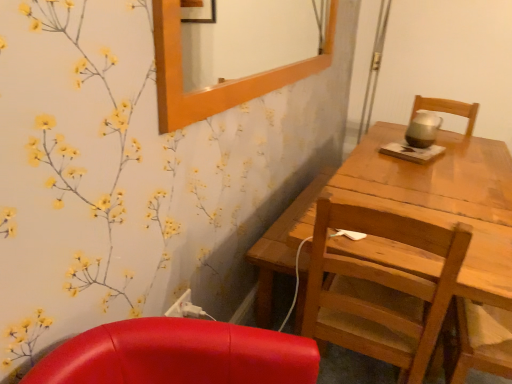
Question: Can you confirm if wooden frame at upper center is smaller than white plastic power outlet at lower center?

Choices:
 (A) no
 (B) yes

Answer: (A)

Question: Does wooden frame at upper center have a greater height compared to white plastic power outlet at lower center?

Choices:
 (A) yes
 (B) no

Answer: (A)

Question: Does wooden frame at upper center have a lesser width compared to white plastic power outlet at lower center?

Choices:
 (A) no
 (B) yes

Answer: (A)

Question: Is wooden frame at upper center not within white plastic power outlet at lower center?

Choices:
 (A) yes
 (B) no

Answer: (A)

Question: Is wooden frame at upper center in contact with white plastic power outlet at lower center?

Choices:
 (A) no
 (B) yes

Answer: (A)

Question: Considering the positions of wooden chair at right and gold metallic teapot at upper right in the image, is wooden chair at right bigger or smaller than gold metallic teapot at upper right?

Choices:
 (A) big
 (B) small

Answer: (A)

Question: In terms of width, does wooden chair at right look wider or thinner when compared to gold metallic teapot at upper right?

Choices:
 (A) thin
 (B) wide

Answer: (B)

Question: In the image, is wooden chair at right positioned in front of or behind gold metallic teapot at upper right?

Choices:
 (A) behind
 (B) front

Answer: (B)

Question: From a real-world perspective, relative to gold metallic teapot at upper right, is wooden chair at right vertically above or below?

Choices:
 (A) above
 (B) below

Answer: (B)

Question: Is wooden frame at upper center bigger or smaller than gold metallic teapot at upper right?

Choices:
 (A) big
 (B) small

Answer: (A)

Question: Is point (188, 34) closer or farther from the camera than point (415, 142)?

Choices:
 (A) closer
 (B) farther

Answer: (B)

Question: From the image's perspective, relative to gold metallic teapot at upper right, is wooden frame at upper center above or below?

Choices:
 (A) above
 (B) below

Answer: (A)

Question: Choose the correct answer: Is wooden frame at upper center inside gold metallic teapot at upper right or outside it?

Choices:
 (A) inside
 (B) outside

Answer: (B)

Question: Is gold metallic teapot at upper right taller or shorter than wooden frame at upper center?

Choices:
 (A) tall
 (B) short

Answer: (B)

Question: From a real-world perspective, relative to wooden frame at upper center, is gold metallic teapot at upper right vertically above or below?

Choices:
 (A) below
 (B) above

Answer: (A)